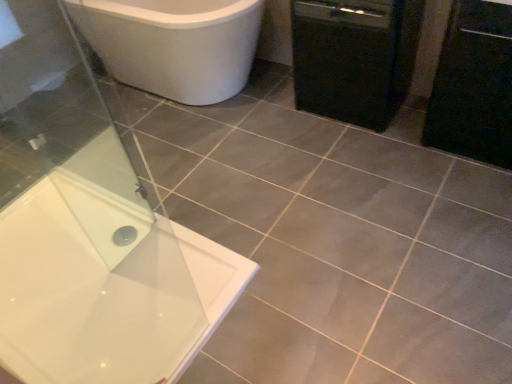
Question: Does white glossy bathtub at upper left lie behind transparent glass screen door at lower left?

Choices:
 (A) no
 (B) yes

Answer: (A)

Question: Is white glossy bathtub at upper left at the right side of transparent glass screen door at lower left?

Choices:
 (A) yes
 (B) no

Answer: (A)

Question: From a real-world perspective, is white glossy bathtub at upper left physically above transparent glass screen door at lower left?

Choices:
 (A) yes
 (B) no

Answer: (A)

Question: Is white glossy bathtub at upper left placed right next to transparent glass screen door at lower left?

Choices:
 (A) no
 (B) yes

Answer: (A)

Question: From a real-world perspective, is white glossy bathtub at upper left below transparent glass screen door at lower left?

Choices:
 (A) no
 (B) yes

Answer: (A)

Question: Choose the correct answer: Is black matte cabinet at right inside black matte dishwasher at right or outside it?

Choices:
 (A) outside
 (B) inside

Answer: (A)

Question: Does point (441, 67) appear closer or farther from the camera than point (310, 57)?

Choices:
 (A) closer
 (B) farther

Answer: (A)

Question: From the image's perspective, is black matte cabinet at right above or below black matte dishwasher at right?

Choices:
 (A) above
 (B) below

Answer: (B)

Question: From a real-world perspective, is black matte cabinet at right above or below black matte dishwasher at right?

Choices:
 (A) below
 (B) above

Answer: (B)

Question: From a real-world perspective, is black matte cabinet at right above or below white glossy bathtub at upper left?

Choices:
 (A) below
 (B) above

Answer: (A)

Question: Relative to white glossy bathtub at upper left, is black matte cabinet at right in front or behind?

Choices:
 (A) front
 (B) behind

Answer: (B)

Question: From their relative heights in the image, would you say black matte cabinet at right is taller or shorter than white glossy bathtub at upper left?

Choices:
 (A) tall
 (B) short

Answer: (B)

Question: Would you say black matte cabinet at right is inside or outside white glossy bathtub at upper left?

Choices:
 (A) outside
 (B) inside

Answer: (A)

Question: In terms of height, does black matte dishwasher at right look taller or shorter compared to transparent glass screen door at lower left?

Choices:
 (A) tall
 (B) short

Answer: (B)

Question: Is point (316, 13) closer or farther from the camera than point (86, 104)?

Choices:
 (A) farther
 (B) closer

Answer: (B)